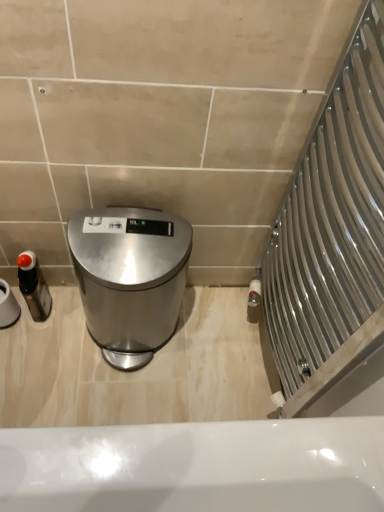
Question: From the image's perspective, is white matte toilet paper at left above or below satin silver trash can at center?

Choices:
 (A) below
 (B) above

Answer: (B)

Question: In the image, is white matte toilet paper at left on the left side or the right side of satin silver trash can at center?

Choices:
 (A) right
 (B) left

Answer: (B)

Question: Based on their relative distances, which object is nearer to the satin silver trash can at center?

Choices:
 (A) matte black bottle at left
 (B) white matte toilet paper at left

Answer: (A)

Question: Which is farther from the white matte toilet paper at left?

Choices:
 (A) satin silver trash can at center
 (B) matte black bottle at left

Answer: (A)